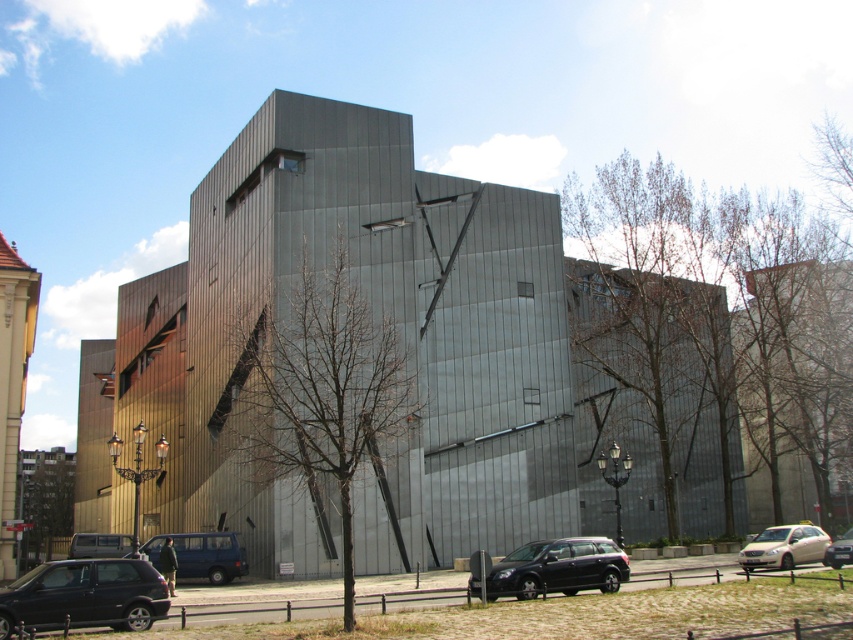
You are a photographer standing in front of the modern building. You want to take a photo that includes both the bare branches at center and the shiny black suv at center. Which object should you adjust your camera angle to focus on first if you want to capture both in the frame?

You should focus on the shiny black suv at center first because the bare branches at center is to the left of it, so adjusting the angle to include both would require positioning the suv centrally and then framing the branches to its left.

You are a delivery person driving a shiny black suv at center and need to park it near the building. The parking space requires the vehicle to be within 10 meters of the bare branches at center. Can you park your vehicle in this location?

The distance between the shiny black suv at center and the bare branches at center is 12.43 meters, which exceeds the parking requirement of 10 meters. Therefore, you cannot park the shiny black suv at center in this location.